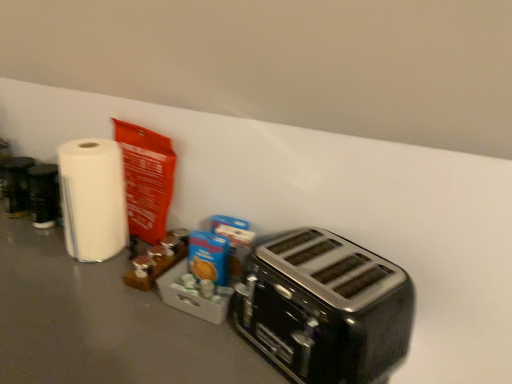
Question: Based on their positions, is white glossy paper towel at left located to the left or right of black metallic toaster at lower right?

Choices:
 (A) left
 (B) right

Answer: (A)

Question: From a real-world perspective, is white glossy paper towel at left physically located above or below black metallic toaster at lower right?

Choices:
 (A) below
 (B) above

Answer: (B)

Question: From the image's perspective, is white glossy paper towel at left positioned above or below black metallic toaster at lower right?

Choices:
 (A) below
 (B) above

Answer: (B)

Question: From the image's perspective, is black metallic toaster at lower right positioned above or below white glossy paper towel at left?

Choices:
 (A) below
 (B) above

Answer: (A)

Question: Which is correct: black metallic toaster at lower right is inside white glossy paper towel at left, or outside of it?

Choices:
 (A) outside
 (B) inside

Answer: (A)

Question: In terms of height, does black metallic toaster at lower right look taller or shorter compared to white glossy paper towel at left?

Choices:
 (A) tall
 (B) short

Answer: (B)

Question: Does point (292, 336) appear closer or farther from the camera than point (84, 142)?

Choices:
 (A) farther
 (B) closer

Answer: (B)